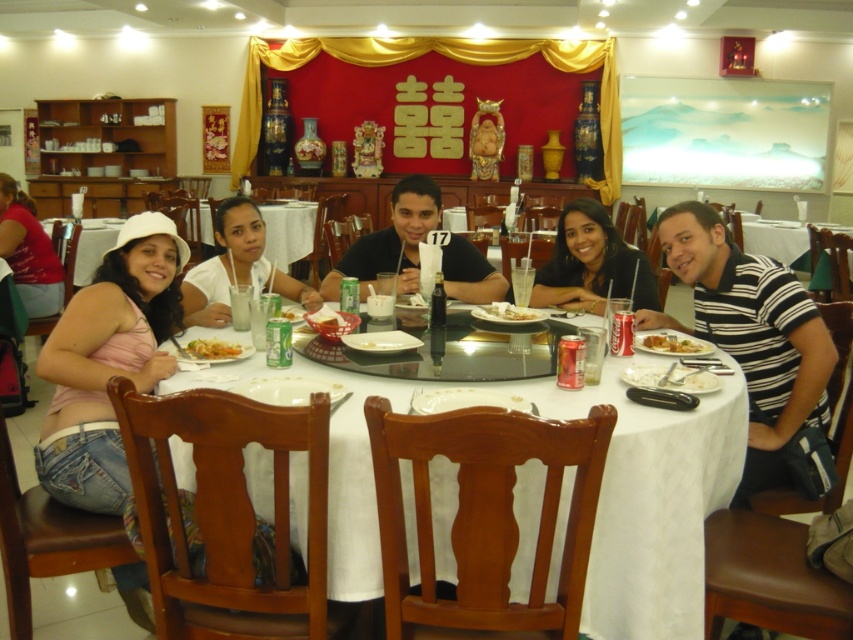
Which of these two, white wood table at center or white matte plate at center, stands taller?

white wood table at center is taller.

Is white wood table at center smaller than white matte plate at center?

Actually, white wood table at center might be larger than white matte plate at center.

Where is `white wood table at center`? This screenshot has height=640, width=853. white wood table at center is located at coordinates [598, 497].

The image size is (853, 640). Find the location of `white wood table at center`. white wood table at center is located at coordinates (598, 497).

Is matte black hair at center positioned before shiny plastic fork at lower right?

No, matte black hair at center is further to the viewer.

Between matte black hair at center and shiny plastic fork at lower right, which one is positioned higher?

matte black hair at center

The image size is (853, 640). Describe the element at coordinates (592, 264) in the screenshot. I see `matte black hair at center` at that location.

The width and height of the screenshot is (853, 640). I want to click on matte black hair at center, so click(x=592, y=264).

Is matte black hair at center wider than matte white shirt at center?

Correct, the width of matte black hair at center exceeds that of matte white shirt at center.

Between point (575, 243) and point (265, 259), which one is positioned behind?

The point (265, 259) is behind.

Locate an element on the screen. Image resolution: width=853 pixels, height=640 pixels. matte black hair at center is located at coordinates (592, 264).